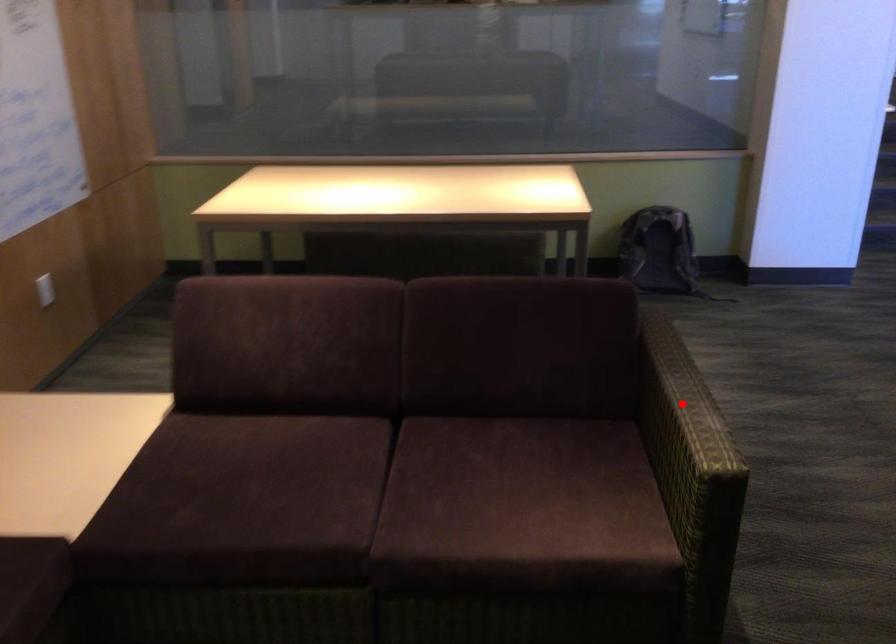
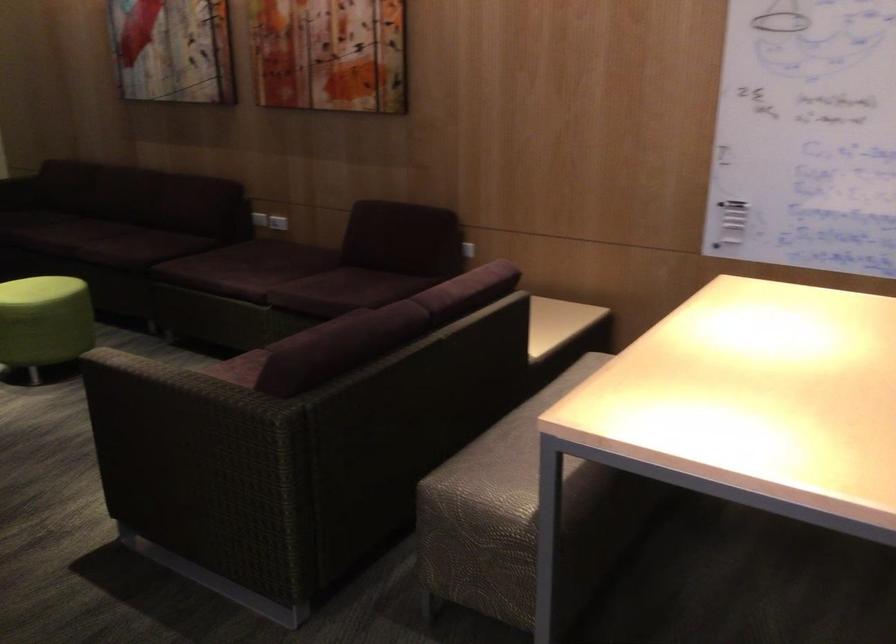
Question: I am providing you with two images of the same scene from different viewpoints. A red point is marked on the first image. At the location where the point appears in image 1, is it still visible in image 2?

Choices:
 (A) Yes
 (B) No

Answer: (B)